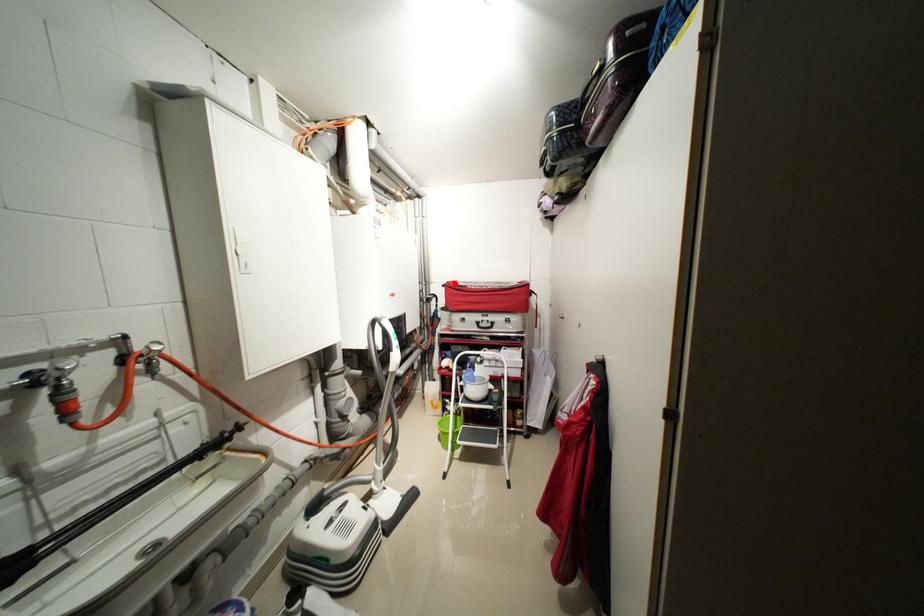
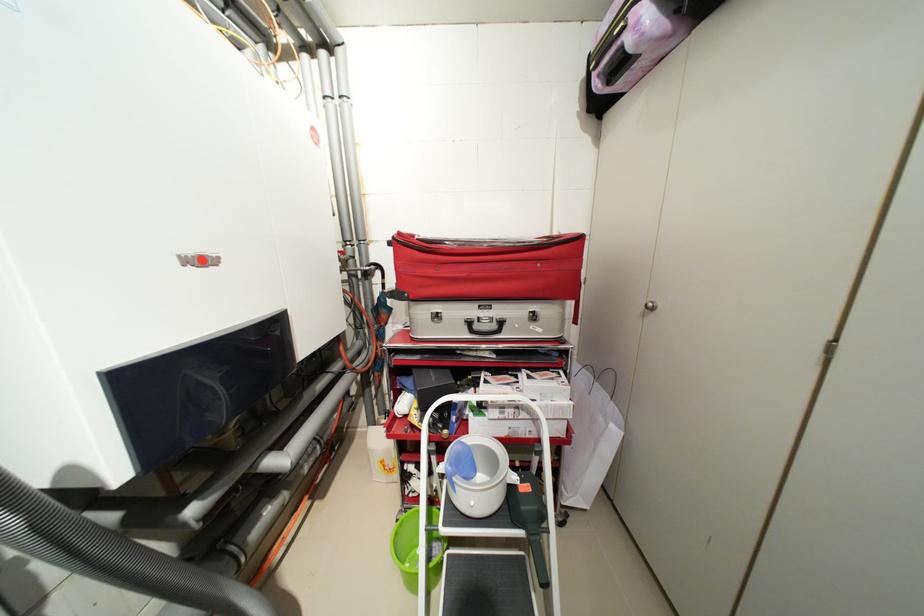
Where in the second image is the point corresponding to the highlighted location from the first image?

(407, 235)